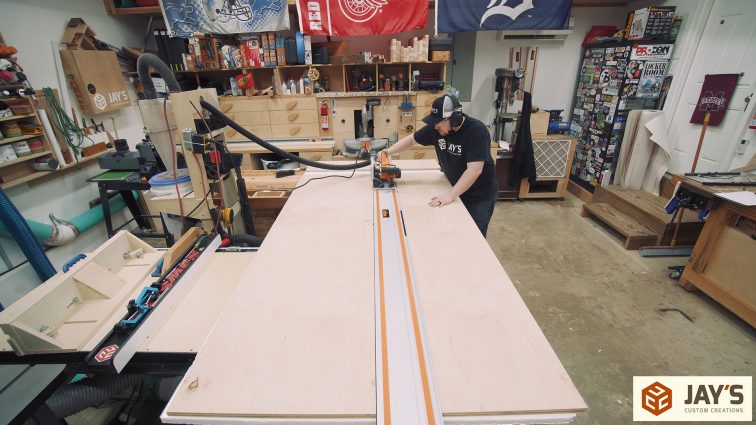
At what (x,y) coordinates should I click in order to perform the action: click on extension cord. Please return your answer as a coordinate pair (x, y). The image size is (756, 425). Looking at the image, I should click on (169, 134), (69, 135).